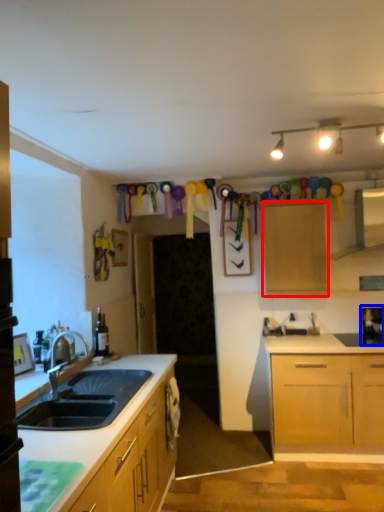
Question: Which object is closer to the camera taking this photo, cabinetry (highlighted by a red box) or appliance (highlighted by a blue box)?

Choices:
 (A) cabinetry
 (B) appliance

Answer: (A)